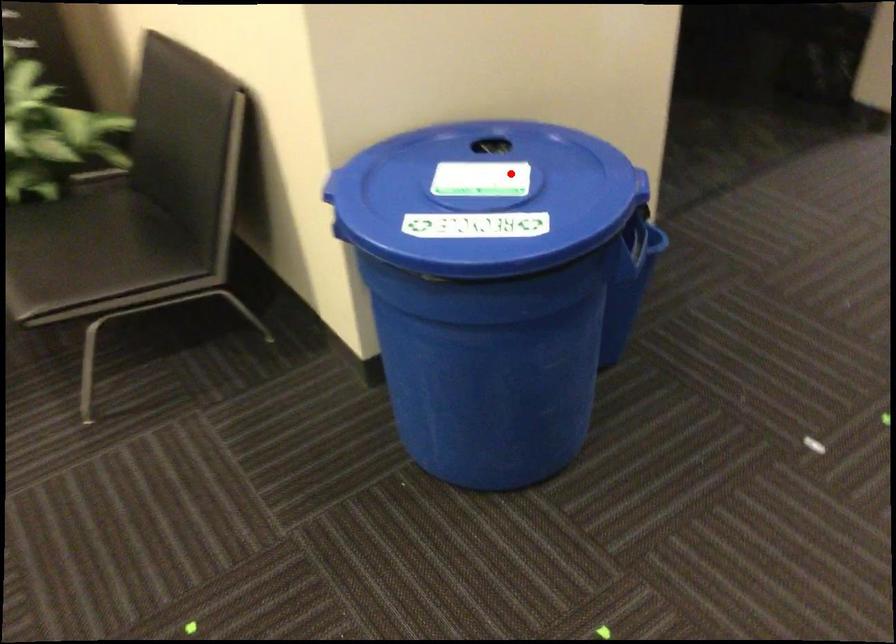
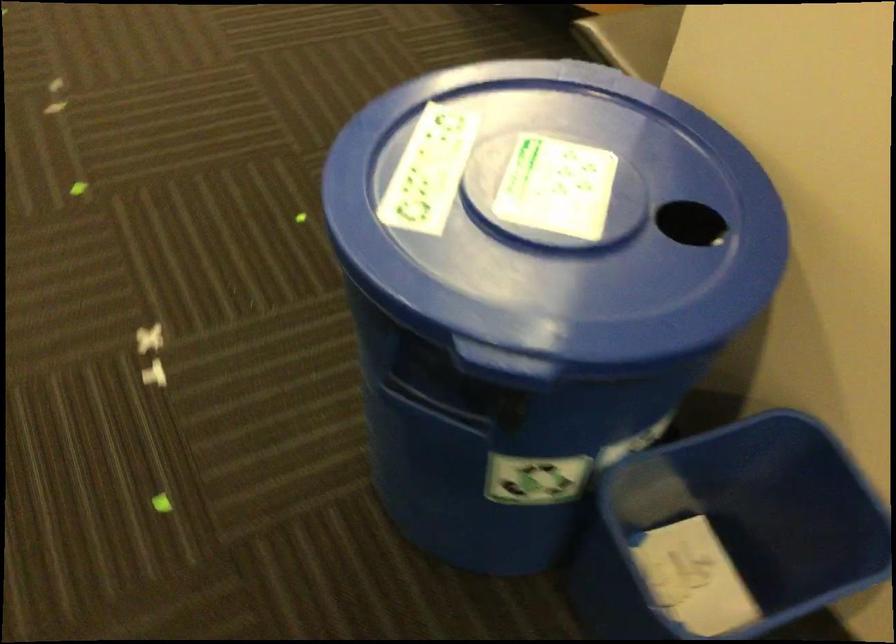
Question: A red point is marked in image1. In image2, is the corresponding 3D point closer to the camera or farther? Reply with the corresponding letter.

Choices:
 (A) The corresponding 3D point is closer.
 (B) The corresponding 3D point is farther.

Answer: (A)